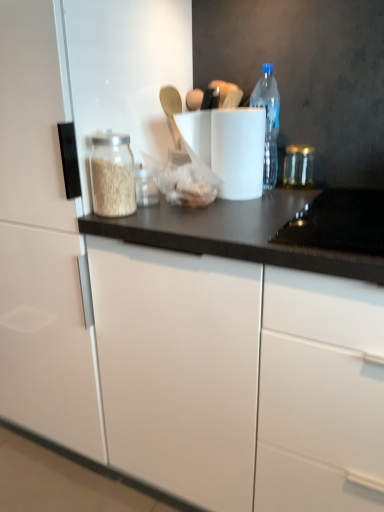
Question: From a real-world perspective, is white glossy cabinet at left beneath white matte paper towel at center?

Choices:
 (A) yes
 (B) no

Answer: (A)

Question: Considering the relative sizes of white glossy cabinet at left and white matte paper towel at center in the image provided, is white glossy cabinet at left wider than white matte paper towel at center?

Choices:
 (A) no
 (B) yes

Answer: (B)

Question: Does white glossy cabinet at left contain white matte paper towel at center?

Choices:
 (A) yes
 (B) no

Answer: (B)

Question: From the image's perspective, would you say white glossy cabinet at left is positioned over white matte paper towel at center?

Choices:
 (A) yes
 (B) no

Answer: (B)

Question: Can you see white glossy cabinet at left touching white matte paper towel at center?

Choices:
 (A) no
 (B) yes

Answer: (A)

Question: Does point (269, 71) appear closer or farther from the camera than point (1, 369)?

Choices:
 (A) farther
 (B) closer

Answer: (B)

Question: From the image's perspective, is transparent plastic bottle at upper right above or below white glossy cabinet at left?

Choices:
 (A) above
 (B) below

Answer: (A)

Question: Based on their positions, is transparent plastic bottle at upper right located to the left or right of white glossy cabinet at left?

Choices:
 (A) left
 (B) right

Answer: (B)

Question: Do you think transparent plastic bottle at upper right is within white glossy cabinet at left, or outside of it?

Choices:
 (A) outside
 (B) inside

Answer: (A)

Question: Looking at their shapes, would you say transparent plastic bottle at upper right is wider or thinner than white matte paper towel at center?

Choices:
 (A) wide
 (B) thin

Answer: (B)

Question: Is transparent plastic bottle at upper right bigger or smaller than white matte paper towel at center?

Choices:
 (A) small
 (B) big

Answer: (A)

Question: Choose the correct answer: Is transparent plastic bottle at upper right inside white matte paper towel at center or outside it?

Choices:
 (A) inside
 (B) outside

Answer: (B)

Question: Considering the positions of point (274, 123) and point (256, 177), is point (274, 123) closer or farther from the camera than point (256, 177)?

Choices:
 (A) closer
 (B) farther

Answer: (B)

Question: Considering the positions of white glossy cabinet at left and transparent glass jar at right in the image, is white glossy cabinet at left wider or thinner than transparent glass jar at right?

Choices:
 (A) thin
 (B) wide

Answer: (B)

Question: From a real-world perspective, is white glossy cabinet at left above or below transparent glass jar at right?

Choices:
 (A) above
 (B) below

Answer: (B)